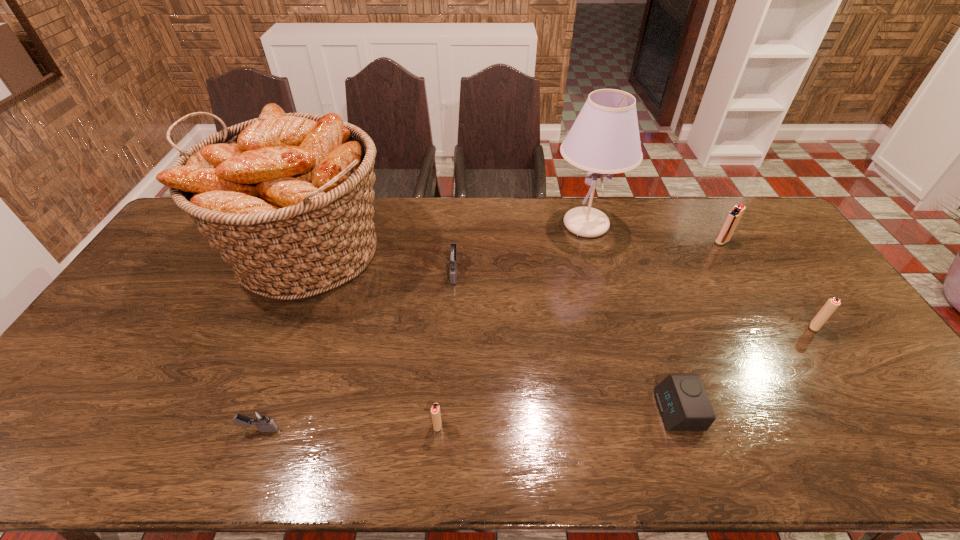
I want to click on red igniter that is the closest to the second red igniter from right to left, so click(832, 304).

Where is `vacant space that satisfies the following two spatial constraints: 1. on the back side of the left gray igniter; 2. on the left side of the right gray igniter`? Image resolution: width=960 pixels, height=540 pixels. vacant space that satisfies the following two spatial constraints: 1. on the back side of the left gray igniter; 2. on the left side of the right gray igniter is located at coordinates (318, 272).

The height and width of the screenshot is (540, 960). In order to click on vacant space that satisfies the following two spatial constraints: 1. on the back side of the leftmost igniter; 2. on the left side of the nearest red igniter in this screenshot , I will do `click(261, 426)`.

Locate an element on the screen. vacant area that satisfies the following two spatial constraints: 1. on the front side of the second smallest red igniter; 2. on the left side of the second red igniter from left to right is located at coordinates [772, 327].